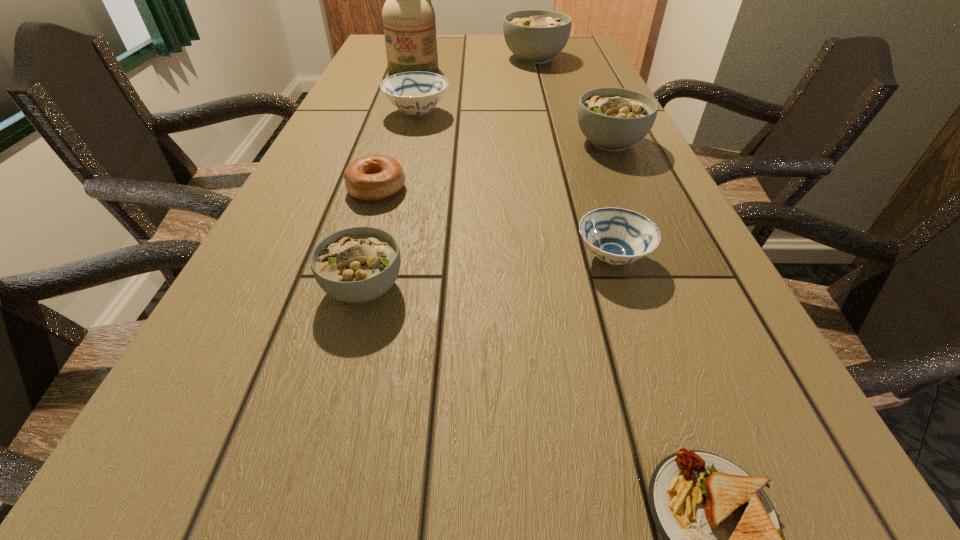
Where is `cleansing agent`? cleansing agent is located at coordinates (409, 23).

At what (x,y) coordinates should I click in order to perform the action: click on the seventh shortest object. Please return your answer as a coordinate pair (x, y). This screenshot has width=960, height=540. Looking at the image, I should click on 535,36.

The image size is (960, 540). What are the coordinates of `the farthest soup bowl` in the screenshot? It's located at (535, 36).

Locate an element on the screen. the second tallest soup bowl is located at coordinates (613, 119).

What are the coordinates of `the second biggest white soup bowl` in the screenshot? It's located at (613, 119).

Find the location of `the bigger blue soup bowl`. the bigger blue soup bowl is located at coordinates (416, 93).

Locate an element on the screen. the left blue soup bowl is located at coordinates (416, 93).

Locate an element on the screen. The image size is (960, 540). the smallest white soup bowl is located at coordinates (355, 265).

Where is `the leftmost white soup bowl`? Image resolution: width=960 pixels, height=540 pixels. the leftmost white soup bowl is located at coordinates (355, 265).

Identify the location of the nearer blue soup bowl. Image resolution: width=960 pixels, height=540 pixels. tap(617, 236).